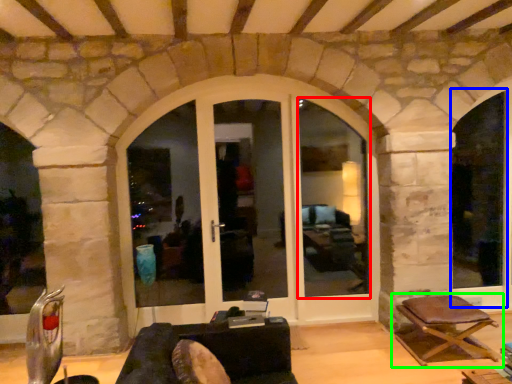
Question: Estimate the real-world distances between objects in this image. Which object is farther from window frame (highlighted by a red box), window frame (highlighted by a blue box) or chair (highlighted by a green box)?

Choices:
 (A) window frame
 (B) chair

Answer: (B)